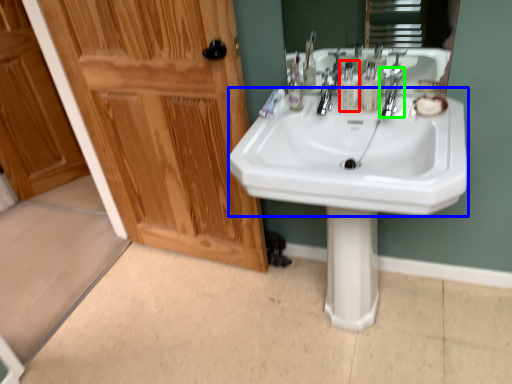
Question: Which is farther away from mouthwash (highlighted by a red box)? sink (highlighted by a blue box) or tap (highlighted by a green box)?

Choices:
 (A) sink
 (B) tap

Answer: (A)